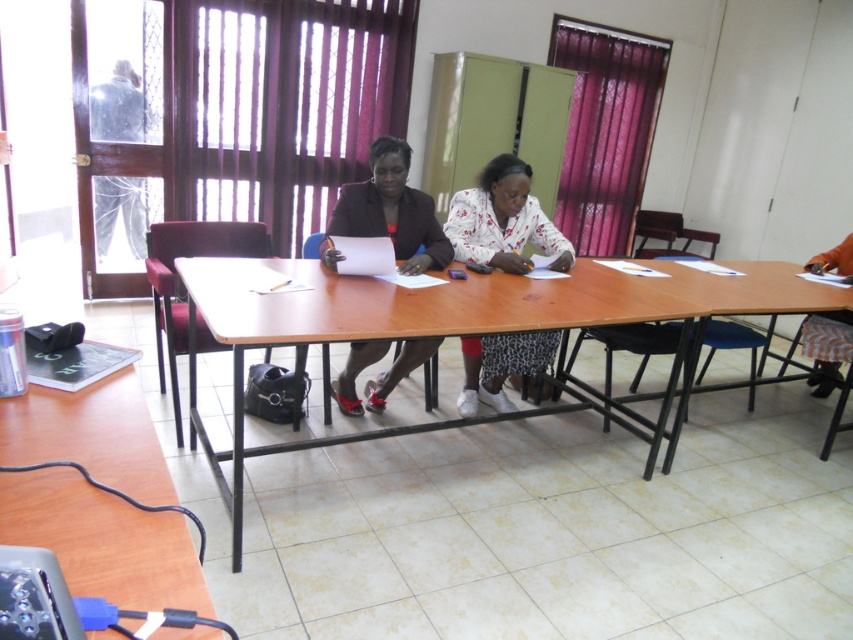
What do you see at coordinates (97, 493) in the screenshot?
I see `brown wooden table at lower left` at bounding box center [97, 493].

Based on the photo, is brown wooden table at lower left positioned behind white printed dress at center?

No, it is in front of white printed dress at center.

At what (x,y) coordinates should I click in order to perform the action: click on brown wooden table at lower left. Please return your answer as a coordinate pair (x, y). The height and width of the screenshot is (640, 853). Looking at the image, I should click on click(97, 493).

Identify the location of brown wooden table at lower left. This screenshot has height=640, width=853. (97, 493).

Does brown wooden table at center have a greater width compared to brown wooden table at lower left?

Yes, brown wooden table at center is wider than brown wooden table at lower left.

Does brown wooden table at center have a greater height compared to brown wooden table at lower left?

Yes.

Between point (666, 460) and point (74, 506), which one is positioned behind?

Point (666, 460)

The height and width of the screenshot is (640, 853). I want to click on brown wooden table at center, so click(x=453, y=326).

Which of these two, matte black skirt at center or orange fabric chair at right, stands taller?

Standing taller between the two is matte black skirt at center.

The height and width of the screenshot is (640, 853). Find the location of `matte black skirt at center`. matte black skirt at center is located at coordinates (387, 212).

Find the location of `matte black skirt at center`. matte black skirt at center is located at coordinates (387, 212).